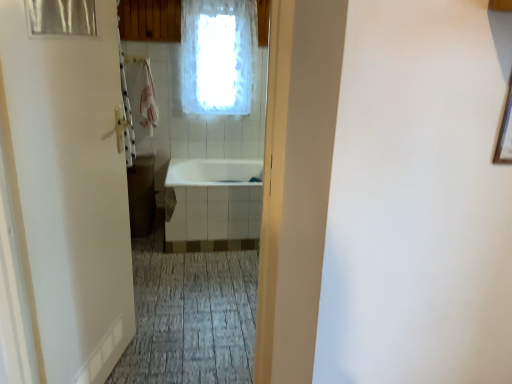
Question: Is white matte door at left in front of or behind white frosted glass window at upper center in the image?

Choices:
 (A) behind
 (B) front

Answer: (B)

Question: Considering the positions of white matte door at left and white frosted glass window at upper center in the image, is white matte door at left taller or shorter than white frosted glass window at upper center?

Choices:
 (A) short
 (B) tall

Answer: (B)

Question: Which object is positioned farthest from the transparent plastic shower curtain at upper left?

Choices:
 (A) white frosted glass window at upper center
 (B) white glossy bathtub at center
 (C) white matte door at left

Answer: (A)

Question: Considering the real-world distances, which object is closest to the white matte door at left?

Choices:
 (A) transparent plastic shower curtain at upper left
 (B) white glossy bathtub at center
 (C) white frosted glass window at upper center

Answer: (A)